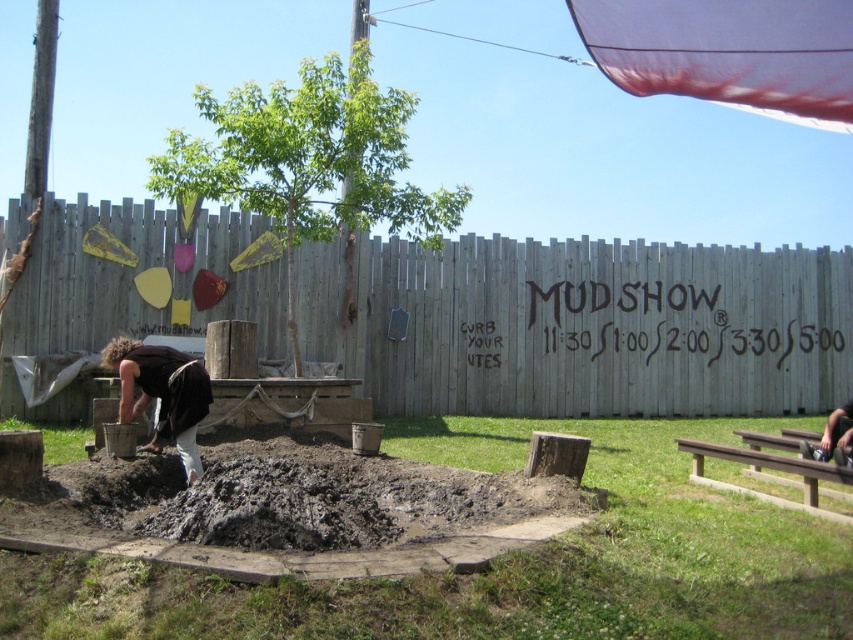
You are planning to build a small garden in the area shown. Considering the brown mud pit at lower center and the dark brown wood at lower left, which one is shorter and would require more soil to level the ground for planting?

The brown mud pit at lower center is shorter than the dark brown wood at lower left, so it would require more soil to level the ground for planting.

You are planning to plant a new tree in the fenced area. The new tree requires a space of at least 5 meters from any existing trees or wooden structures. Based on the scene, is the current distance between the green leafy tree at center and the dark brown wood at lower left sufficient for planting the new tree?

The green leafy tree at center and dark brown wood at lower left are 7.00 meters apart, which is more than the required 5 meters. Therefore, the distance is sufficient for planting the new tree.

You are a participant in a mud show event and need to move from the brown mud pit at lower center to the metallic silver squat at lower right. Which direction should you move to reach the squat?

The brown mud pit at lower center is positioned on the left side of metallic silver squat at lower right, so you should move to the right to reach the metallic silver squat at lower right.